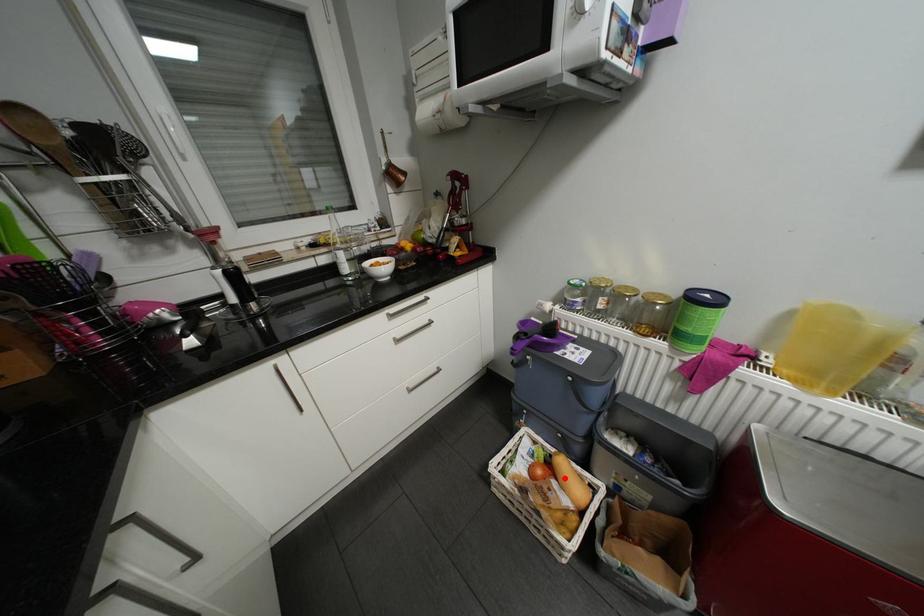
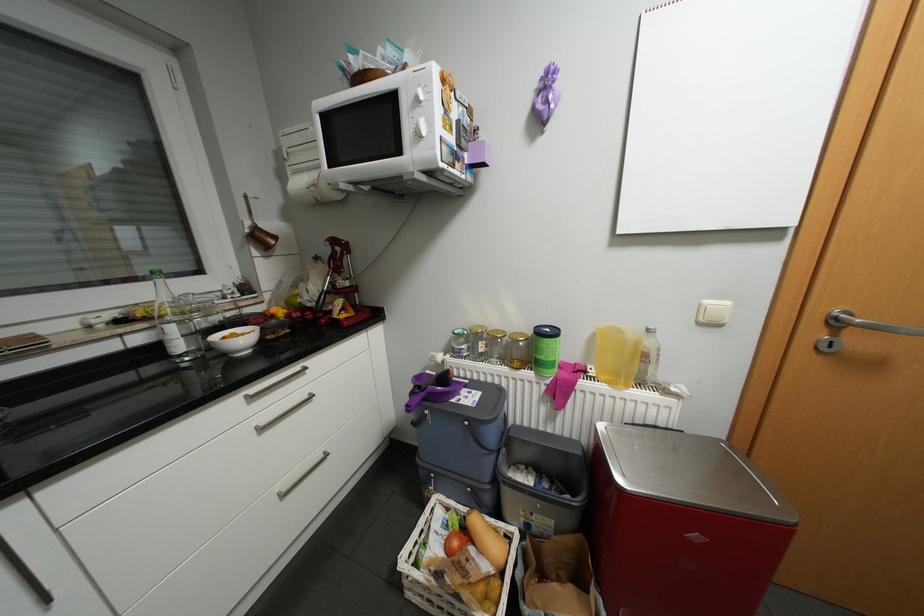
Where in the second image is the point corresponding to the highlighted location from the first image?

(481, 543)